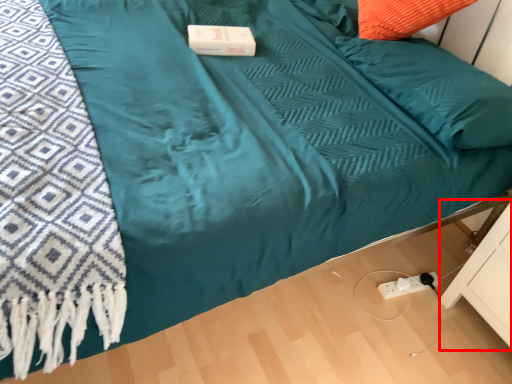
Question: From the image's perspective, what is the correct spatial relationship of drawer (annotated by the red box) in relation to pillow?

Choices:
 (A) above
 (B) below

Answer: (B)